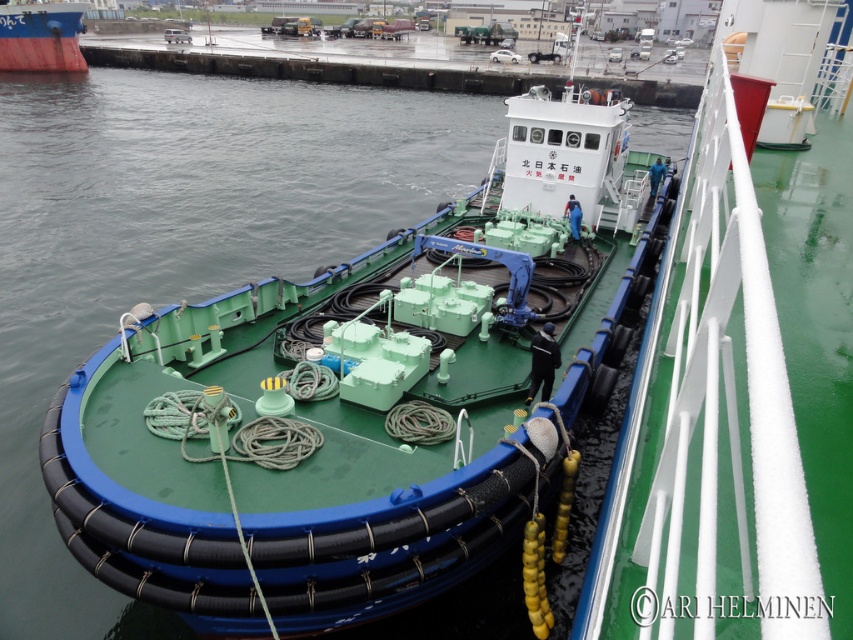
Between point (299, 588) and point (30, 19), which one is positioned behind?

Point (30, 19)

Does green rubber boat at center have a greater width compared to red matte boat at upper left?

Incorrect, green rubber boat at center's width does not surpass red matte boat at upper left's.

Identify the location of green rubber boat at center. (338, 422).